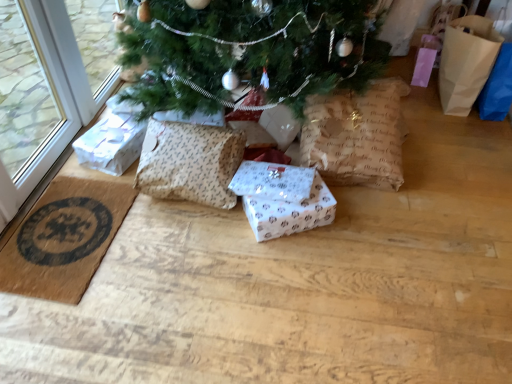
Find the location of `empty space that is ontop of white paper gift box at center, the 3th gift box viewed from the left (from a real-world perspective)`. empty space that is ontop of white paper gift box at center, the 3th gift box viewed from the left (from a real-world perspective) is located at coordinates (289, 206).